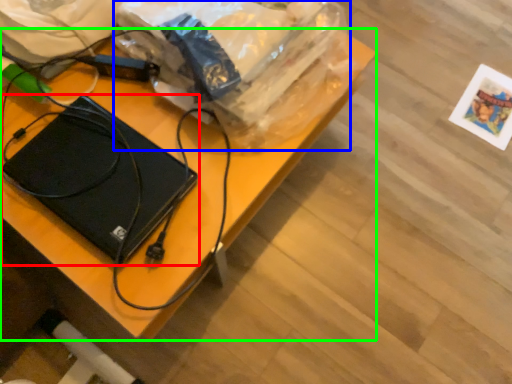
Question: Considering the real-world distances, which object is closest to laptop (highlighted by a red box)? grocery bag (highlighted by a blue box) or desk (highlighted by a green box).

Choices:
 (A) grocery bag
 (B) desk

Answer: (B)